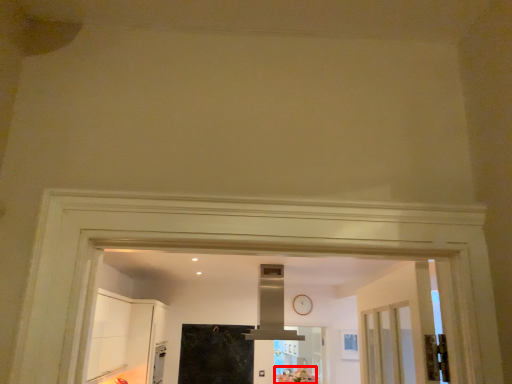
Question: From the image's perspective, where is flower (annotated by the red box) located relative to exhaust hood?

Choices:
 (A) below
 (B) above

Answer: (A)